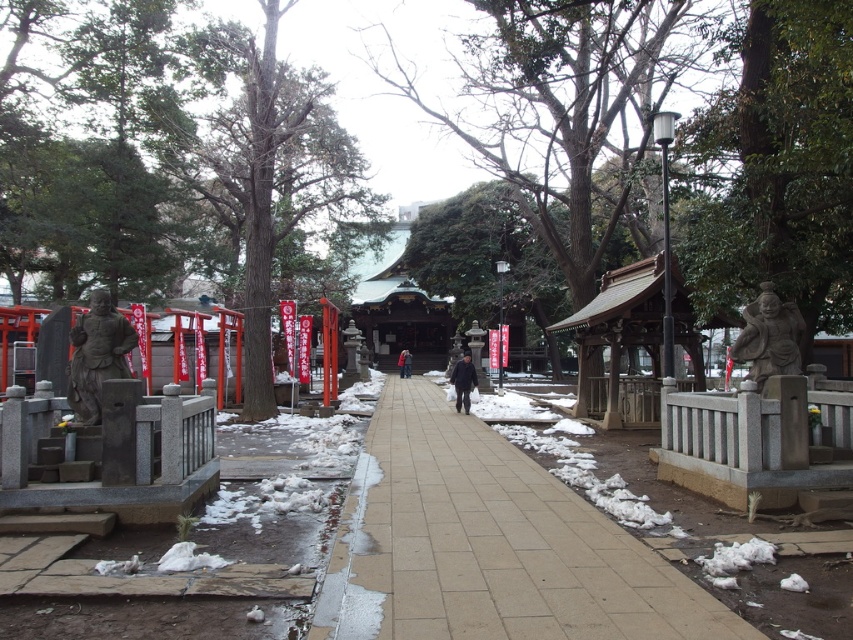
Who is higher up, smooth concrete pavement at center or dark blue fabric coat at center?

dark blue fabric coat at center

Looking at this image, who is lower down, smooth concrete pavement at center or dark blue fabric coat at center?

smooth concrete pavement at center

Does point (437, 620) come closer to viewer compared to point (463, 356)?

Yes.

Where is `smooth concrete pavement at center`? The image size is (853, 640). smooth concrete pavement at center is located at coordinates (489, 545).

Which is below, stone statue at right or dark brown leather jacket at center?

Positioned lower is dark brown leather jacket at center.

Between point (775, 372) and point (402, 358), which one is positioned behind?

Point (402, 358)

Is point (746, 316) more distant than point (401, 365)?

No.

Where is `stone statue at right`? The width and height of the screenshot is (853, 640). stone statue at right is located at coordinates (769, 337).

Between smooth concrete pavement at center and stone statue at right, which one has more height?

With more height is stone statue at right.

Who is more distant from viewer, (x=498, y=612) or (x=796, y=326)?

Point (x=796, y=326)

Who is more distant from viewer, [682,596] or [769,376]?

Positioned behind is point [769,376].

At what (x,y) coordinates should I click in order to perform the action: click on smooth concrete pavement at center. Please return your answer as a coordinate pair (x, y). The image size is (853, 640). Looking at the image, I should click on (489, 545).